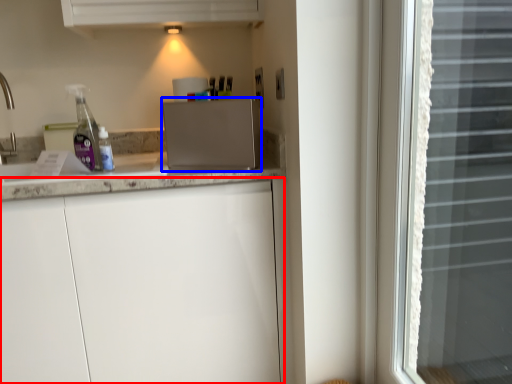
Question: Which object is further to the camera taking this photo, cabinetry (highlighted by a red box) or appliance (highlighted by a blue box)?

Choices:
 (A) cabinetry
 (B) appliance

Answer: (B)